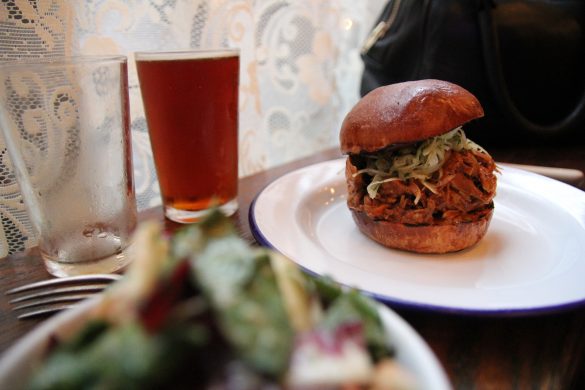
I want to click on plate, so click(450, 268).